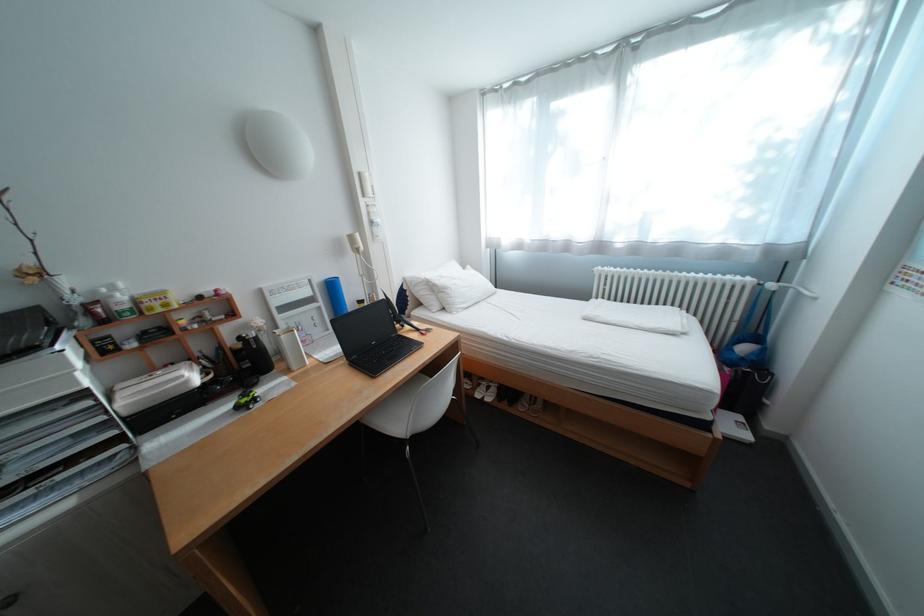
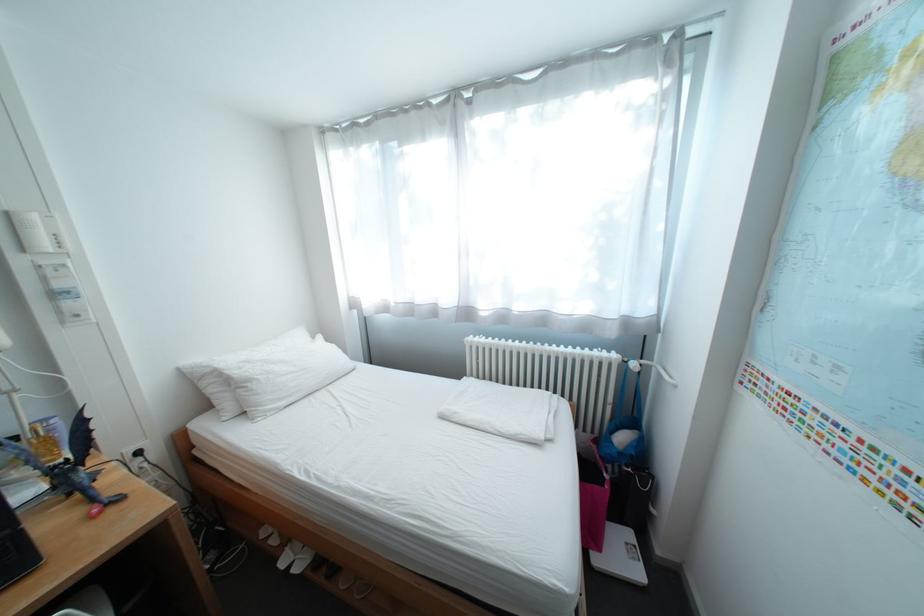
Find the pixel in the second image that matches (416,328) in the first image.

(81, 495)